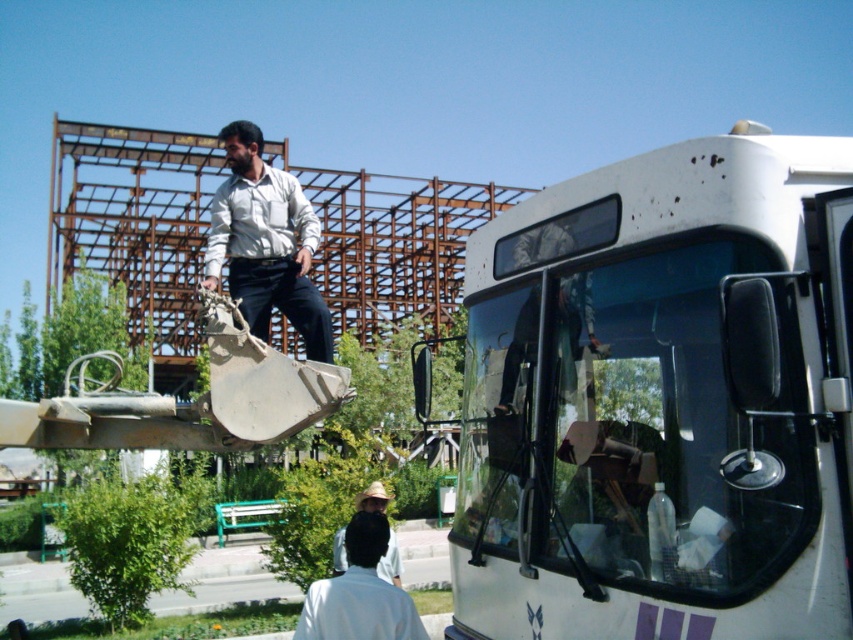
Does white matte bus at center have a lesser width compared to white shirt at upper center?

Correct, white matte bus at center's width is less than white shirt at upper center's.

Does point (668, 330) lie behind point (236, 156)?

No.

Based on the photo, who is more distant from viewer, (x=582, y=408) or (x=281, y=246)?

The point (x=281, y=246) is behind.

The height and width of the screenshot is (640, 853). What are the coordinates of `white matte bus at center` in the screenshot? It's located at (662, 401).

The width and height of the screenshot is (853, 640). What do you see at coordinates (265, 243) in the screenshot? I see `white shirt at upper center` at bounding box center [265, 243].

Is white shirt at upper center positioned in front of white matte shirt at lower center?

No.

Identify the location of white shirt at upper center. (265, 243).

I want to click on white shirt at upper center, so click(x=265, y=243).

Between white matte bus at center and white matte shirt at lower center, which one has less height?

white matte shirt at lower center is shorter.

Is white matte bus at center to the left of white matte shirt at lower center from the viewer's perspective?

No, white matte bus at center is not to the left of white matte shirt at lower center.

Locate an element on the screen. white matte bus at center is located at coordinates (662, 401).

You are a GUI agent. You are given a task and a screenshot of the screen. Output one action in this format:
    pyautogui.click(x=<x>, y=<y>)
    Task: Click on the white matte bus at center
    The width and height of the screenshot is (853, 640).
    Given the screenshot: What is the action you would take?
    pyautogui.click(x=662, y=401)